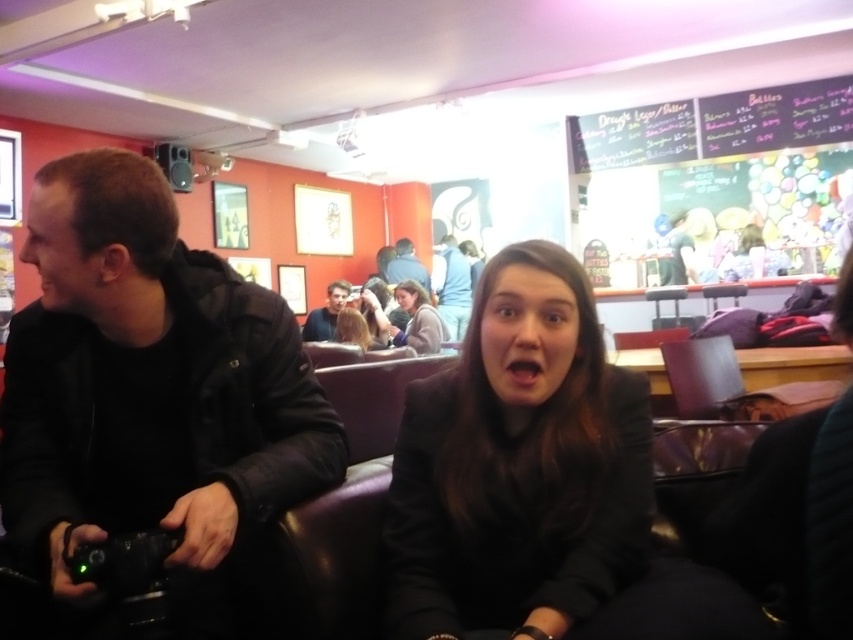
You are sitting at the booth and want to take a photo of the blue denim jacket at center without the black matte jacket at center blocking it. How can you adjust your position to achieve this?

The black matte jacket at center is in front of the blue denim jacket at center. To take a photo of the blue denim jacket at center without the black matte jacket blocking it, you should move your position to the side so that the blue denim jacket at center becomes visible behind the black matte jacket at center.

You are a photographer trying to capture a clear shot of the blue fabric shirt at upper center and the matte gray jacket at center. Which of the two items should you focus on first if you want to ensure both are in frame without moving the camera?

The blue fabric shirt at upper center is to the right of the matte gray jacket at center, so you should focus on the matte gray jacket at center first to ensure both are within the camera frame.

You are standing in the middle of the room and see the point at coordinates (451, 285). Which object is this point located on?

The point at coordinates (451, 285) is located on the blue fabric shirt at upper center.